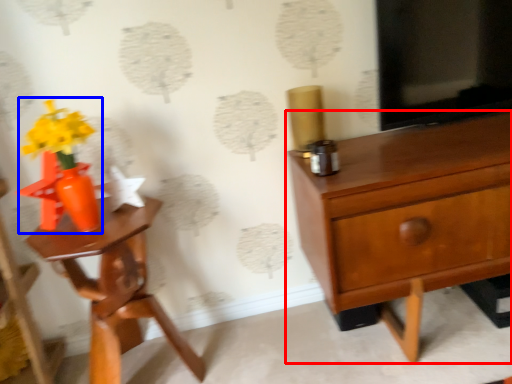
Question: Which object appears closest to the camera in this image, chest of drawers (highlighted by a red box) or floral arrangement (highlighted by a blue box)?

Choices:
 (A) chest of drawers
 (B) floral arrangement

Answer: (A)